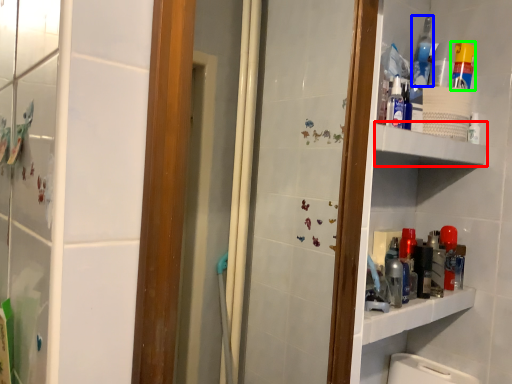
Question: Which is farther away from shelve (highlighted by a red box)? mouthwash (highlighted by a blue box) or cleaning product (highlighted by a green box)?

Choices:
 (A) mouthwash
 (B) cleaning product

Answer: (A)